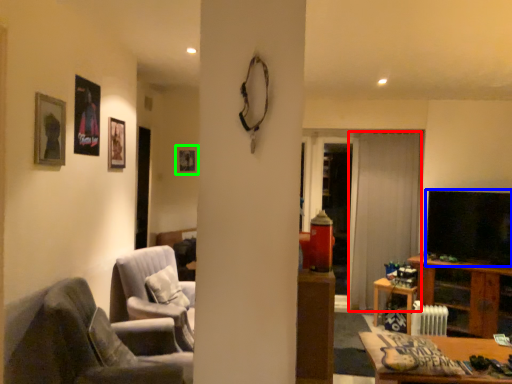
Question: Considering the real-world distances, which object is closest to curtain (highlighted by a red box)? television (highlighted by a blue box) or picture frame (highlighted by a green box).

Choices:
 (A) television
 (B) picture frame

Answer: (A)